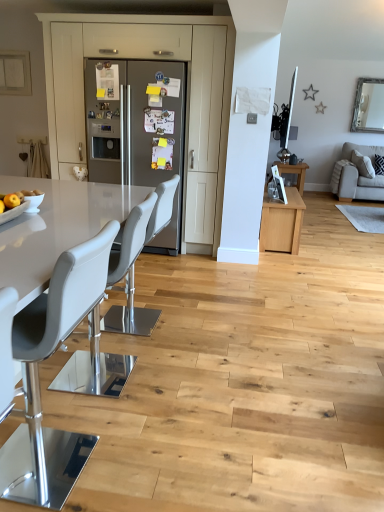
I want to click on white leather chair at center, the 1th chair viewed from the back, so click(136, 258).

What do you see at coordinates (136, 258) in the screenshot? I see `white leather chair at center, the 1th chair viewed from the back` at bounding box center [136, 258].

Find the location of a particular element. The width and height of the screenshot is (384, 512). wooden table at center is located at coordinates (294, 172).

Measure the distance between gray leather bar stool at center, the second chair from the front, and camera.

gray leather bar stool at center, the second chair from the front, is 2.22 meters away from camera.

This screenshot has height=512, width=384. Describe the element at coordinates (94, 367) in the screenshot. I see `gray leather bar stool at center, the second chair from the front` at that location.

Image resolution: width=384 pixels, height=512 pixels. What do you see at coordinates (38, 374) in the screenshot?
I see `gray leather chair at left, which is the 3th chair from back to front` at bounding box center [38, 374].

The image size is (384, 512). Identify the location of satin stainless steel refrigerator at center. coord(140,134).

In order to click on white leather chair at center, positioned as the 3th chair in front-to-back order in this screenshot , I will do `click(136, 258)`.

Is point (91, 88) more distant than point (17, 347)?

Yes, point (91, 88) is behind point (17, 347).

Considering the positions of objects satin stainless steel refrigerator at center and gray leather chair at left, which appears as the 1th chair when viewed from the front, in the image provided, who is more to the left, satin stainless steel refrigerator at center or gray leather chair at left, which appears as the 1th chair when viewed from the front,?

gray leather chair at left, which appears as the 1th chair when viewed from the front, is more to the left.

Is satin stainless steel refrigerator at center oriented away from gray leather chair at left, which appears as the 1th chair when viewed from the front?

No, satin stainless steel refrigerator at center is not facing the opposite direction of gray leather chair at left, which appears as the 1th chair when viewed from the front.

What's the angular difference between satin stainless steel refrigerator at center and gray leather chair at left, which is the 3th chair from back to front,'s facing directions?

The angle between the facing direction of satin stainless steel refrigerator at center and the facing direction of gray leather chair at left, which is the 3th chair from back to front, is 90.6 degrees.

From a real-world perspective, is beige fabric couch at right under satin stainless steel refrigerator at center?

Correct, in the physical world, beige fabric couch at right is lower than satin stainless steel refrigerator at center.

Would you say satin stainless steel refrigerator at center is part of beige fabric couch at right's contents?

No.

Which point is more forward, (346, 181) or (115, 156)?

The point (115, 156) is in front.

Is gray leather bar stool at center, the second chair from the front, smaller than satin stainless steel refrigerator at center?

Yes, gray leather bar stool at center, the second chair from the front, is smaller than satin stainless steel refrigerator at center.

Considering the points (96, 338) and (158, 181), which point is in front, point (96, 338) or point (158, 181)?

The point (96, 338) is in front.

Is gray leather bar stool at center, which is the second chair in back-to-front order, inside or outside of satin stainless steel refrigerator at center?

gray leather bar stool at center, which is the second chair in back-to-front order, is not enclosed by satin stainless steel refrigerator at center.

Which object is more forward, gray leather bar stool at center, which is the second chair in back-to-front order, or satin stainless steel refrigerator at center?

Positioned in front is gray leather bar stool at center, which is the second chair in back-to-front order.

Is gray leather chair at left, which appears as the 1th chair when viewed from the front, inside or outside of gray leather bar stool at center, which is the second chair in back-to-front order?

gray leather chair at left, which appears as the 1th chair when viewed from the front, is spatially situated outside gray leather bar stool at center, which is the second chair in back-to-front order.

In the scene shown: In the image, is gray leather chair at left, which is the 3th chair from back to front, on the left side or the right side of gray leather bar stool at center, the second chair from the front?

Based on their positions, gray leather chair at left, which is the 3th chair from back to front, is located to the left of gray leather bar stool at center, the second chair from the front.

In terms of size, does gray leather chair at left, which is the 3th chair from back to front, appear bigger or smaller than gray leather bar stool at center, the second chair from the front?

gray leather chair at left, which is the 3th chair from back to front, is bigger than gray leather bar stool at center, the second chair from the front.

Can you confirm if gray leather bar stool at center, the second chair from the front, is bigger than wooden table at center?

Yes, gray leather bar stool at center, the second chair from the front, is bigger than wooden table at center.

You are a GUI agent. You are given a task and a screenshot of the screen. Output one action in this format:
    pyautogui.click(x=<x>, y=<y>)
    Task: Click on the table behind the gray leather bar stool at center, which is the second chair in back-to-front order
    The width and height of the screenshot is (384, 512).
    Given the screenshot: What is the action you would take?
    pyautogui.click(x=294, y=172)

Can you see gray leather bar stool at center, which is the second chair in back-to-front order, touching wooden table at center?

No, gray leather bar stool at center, which is the second chair in back-to-front order, is not with wooden table at center.

From the image's perspective, is gray leather bar stool at center, the second chair from the front, located beneath matte gray cabinet at center?

Indeed, from the image's perspective, gray leather bar stool at center, the second chair from the front, is shown beneath matte gray cabinet at center.

Considering the sizes of objects gray leather bar stool at center, which is the second chair in back-to-front order, and matte gray cabinet at center in the image provided, who is bigger, gray leather bar stool at center, which is the second chair in back-to-front order, or matte gray cabinet at center?

Bigger between the two is matte gray cabinet at center.

Can you confirm if gray leather bar stool at center, which is the second chair in back-to-front order, is shorter than matte gray cabinet at center?

Correct, gray leather bar stool at center, which is the second chair in back-to-front order, is not as tall as matte gray cabinet at center.

Could you tell me if gray leather bar stool at center, the second chair from the front, is turned towards matte gray cabinet at center?

No, gray leather bar stool at center, the second chair from the front, is not aimed at matte gray cabinet at center.

From a real-world perspective, is beige fabric couch at right on top of gray leather bar stool at center, which is the second chair in back-to-front order?

No, from a real-world perspective, beige fabric couch at right is not over gray leather bar stool at center, which is the second chair in back-to-front order

Considering the points (378, 147) and (114, 269), which point is behind, point (378, 147) or point (114, 269)?

Positioned behind is point (378, 147).

Image resolution: width=384 pixels, height=512 pixels. In order to click on studio couch that is under the gray leather bar stool at center, which is the second chair in back-to-front order (from a real-world perspective) in this screenshot , I will do `click(356, 175)`.

The image size is (384, 512). In order to click on chair on the left of satin stainless steel refrigerator at center in this screenshot , I will do `click(38, 374)`.

You are a GUI agent. You are given a task and a screenshot of the screen. Output one action in this format:
    pyautogui.click(x=<x>, y=<y>)
    Task: Click on the studio couch behind the satin stainless steel refrigerator at center
    
    Given the screenshot: What is the action you would take?
    pyautogui.click(x=356, y=175)

Based on their spatial positions, is gray leather bar stool at center, which is the second chair in back-to-front order, or white leather chair at center, the 1th chair viewed from the back, closer to beige fabric couch at right?

white leather chair at center, the 1th chair viewed from the back, lies closer to beige fabric couch at right than the other object.

Based on their spatial positions, is beige fabric couch at right or matte gray cabinet at center further from wooden table at center?

matte gray cabinet at center lies further to wooden table at center than the other object.

Which object lies nearer to the anchor point white leather chair at center, the 1th chair viewed from the back, beige fabric couch at right or matte gray cabinet at center?

matte gray cabinet at center.

When comparing their distances from matte gray cabinet at center, does white leather chair at center, the 1th chair viewed from the back, or gray leather chair at left, which appears as the 1th chair when viewed from the front, seem further?

Based on the image, gray leather chair at left, which appears as the 1th chair when viewed from the front, appears to be further to matte gray cabinet at center.

Estimate the real-world distances between objects in this image. Which object is closer to beige fabric couch at right, matte gray cabinet at center or gray leather chair at left, which is the 3th chair from back to front?

matte gray cabinet at center is positioned closer to the anchor beige fabric couch at right.

Estimate the real-world distances between objects in this image. Which object is closer to gray leather chair at left, which is the 3th chair from back to front, white leather chair at center, the 1th chair viewed from the back, or satin stainless steel refrigerator at center?

white leather chair at center, the 1th chair viewed from the back, lies closer to gray leather chair at left, which is the 3th chair from back to front, than the other object.

Looking at the image, which one is located closer to beige fabric couch at right, white leather chair at center, the 1th chair viewed from the back, or matte gray cabinet at center?

matte gray cabinet at center lies closer to beige fabric couch at right than the other object.

Which object lies further to the anchor point white leather chair at center, positioned as the 3th chair in front-to-back order, beige fabric couch at right or gray leather bar stool at center, the second chair from the front?

beige fabric couch at right is positioned further to the anchor white leather chair at center, positioned as the 3th chair in front-to-back order.

Identify the location of fridge between gray leather chair at left, which appears as the 1th chair when viewed from the front, and wooden table at center from front to back. This screenshot has height=512, width=384. (140, 134).

The height and width of the screenshot is (512, 384). I want to click on chair positioned between gray leather bar stool at center, the second chair from the front, and satin stainless steel refrigerator at center from near to far, so click(x=136, y=258).

Find the location of `studio couch between gray leather bar stool at center, the second chair from the front, and wooden table at center from front to back`. studio couch between gray leather bar stool at center, the second chair from the front, and wooden table at center from front to back is located at coordinates (356, 175).

I want to click on fridge between white leather chair at center, positioned as the 3th chair in front-to-back order, and beige fabric couch at right, along the z-axis, so click(140, 134).